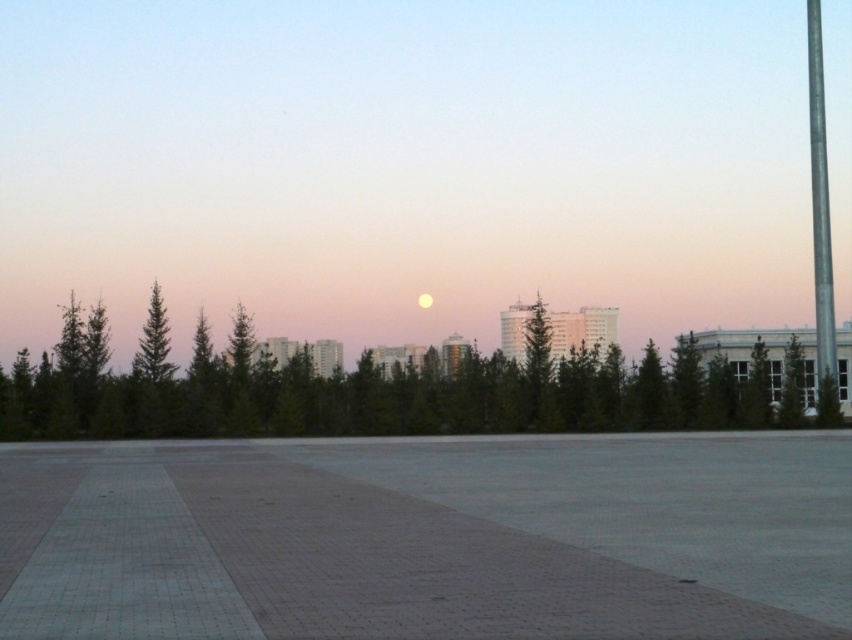
Question: Among these objects, which one is nearest to the camera?

Choices:
 (A) metallic pole at right
 (B) golden reflective moon at center
 (C) green leafy tree at center

Answer: (C)

Question: Is green leafy tree at center to the left of green matte tree at center from the viewer's perspective?

Choices:
 (A) yes
 (B) no

Answer: (A)

Question: Which of the following is the farthest from the observer?

Choices:
 (A) (799, 358)
 (B) (423, 300)

Answer: (B)

Question: Where is green leafy tree at center located in relation to metallic pole at right in the image?

Choices:
 (A) right
 (B) left

Answer: (B)

Question: Based on their relative distances, which object is nearer to the green matte tree at center?

Choices:
 (A) metallic pole at right
 (B) golden reflective moon at center
 (C) green leafy tree at center

Answer: (C)

Question: Does green matte tree at center lie behind golden reflective moon at center?

Choices:
 (A) yes
 (B) no

Answer: (B)